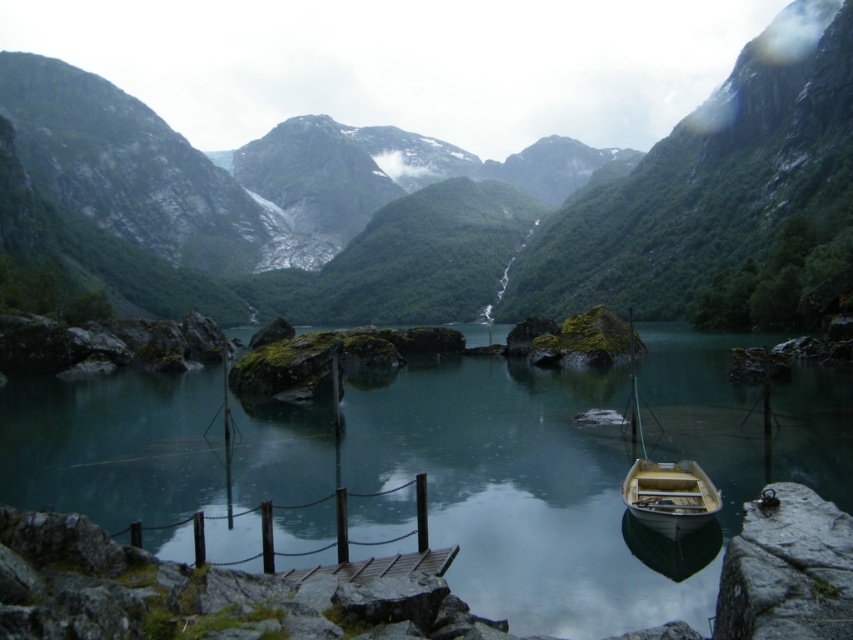
Consider the image. Is teal smooth water at center further to the viewer compared to wooden boat at lower center?

No, it is in front of wooden boat at lower center.

Is teal smooth water at center taller than wooden boat at lower center?

Yes, teal smooth water at center is taller than wooden boat at lower center.

Does point (461, 442) lie in front of point (693, 490)?

No, (461, 442) is behind (693, 490).

The width and height of the screenshot is (853, 640). In order to click on teal smooth water at center in this screenshot , I will do [x=453, y=467].

Who is more forward, (538,314) or (670,508)?

Point (670,508) is more forward.

Is green mossy rock at center closer to camera compared to wooden boat at lower center?

No.

Does point (62, 99) come in front of point (704, 506)?

No, (62, 99) is further to viewer.

Where is `green mossy rock at center`? green mossy rock at center is located at coordinates (434, 196).

Is point (265, 234) less distant than point (543, 573)?

No, (265, 234) is behind (543, 573).

Is green mossy rock at center to the left of teal smooth water at center from the viewer's perspective?

Yes, green mossy rock at center is to the left of teal smooth water at center.

Between point (426, 316) and point (614, 374), which one is positioned behind?

Point (426, 316)

Find the location of a particular element. This screenshot has height=640, width=853. green mossy rock at center is located at coordinates (434, 196).